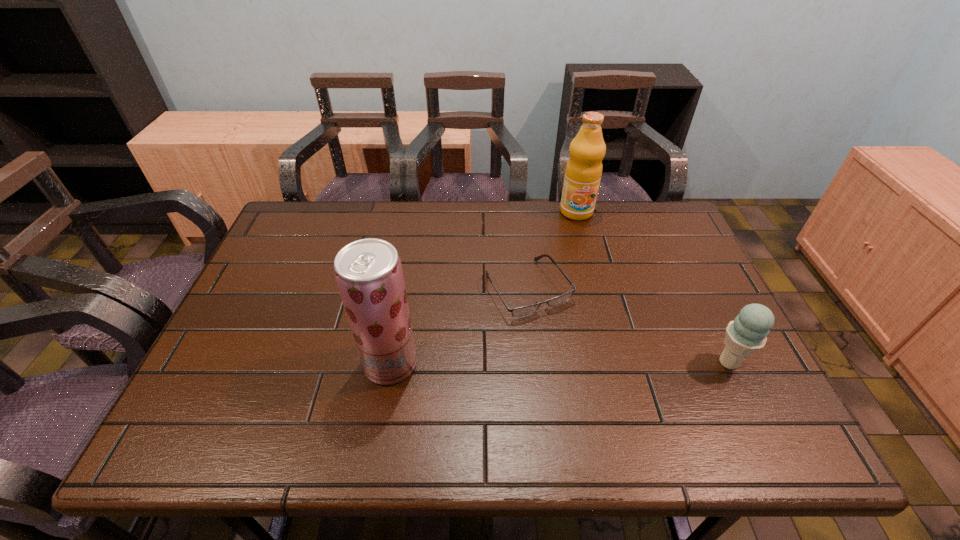
I want to click on object located at the near right corner, so click(747, 334).

This screenshot has height=540, width=960. In the image, there is a desktop. What are the coordinates of `vacant space at the far edge` in the screenshot? It's located at (424, 242).

The image size is (960, 540). In the image, there is a desktop. Identify the location of free region at the left edge. (312, 275).

Locate an element on the screen. free space at the far left corner of the desktop is located at coordinates [x=301, y=224].

Locate an element on the screen. blank space at the far right corner is located at coordinates (685, 235).

Identify the location of vacant space at the near right corner of the desktop. The image size is (960, 540). (726, 374).

You are a GUI agent. You are given a task and a screenshot of the screen. Output one action in this format:
    pyautogui.click(x=<x>, y=<y>)
    Task: Click on the unoccupied area between the left fruit juice and the ice cream
    The height and width of the screenshot is (540, 960).
    Given the screenshot: What is the action you would take?
    pyautogui.click(x=560, y=363)

This screenshot has height=540, width=960. What are the coordinates of `unoccupied area between the farthest object and the ice cream` in the screenshot? It's located at (653, 287).

This screenshot has width=960, height=540. Identify the location of vacant space in between the nearer fruit juice and the second object from right to left. (483, 288).

Find the location of a particular element. The height and width of the screenshot is (540, 960). free space between the shortest object and the ice cream is located at coordinates (629, 325).